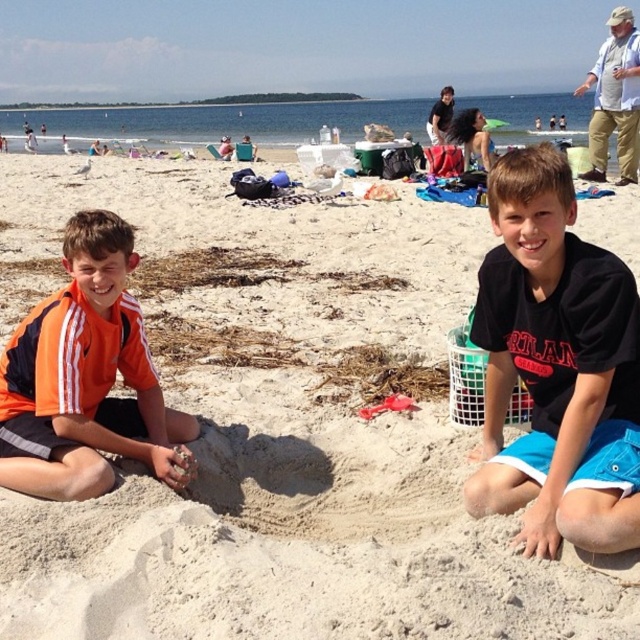
Question: Can you confirm if black cotton shirt at center is smaller than orange jersey at left?

Choices:
 (A) no
 (B) yes

Answer: (A)

Question: Is black cotton shirt at center thinner than orange jersey at left?

Choices:
 (A) no
 (B) yes

Answer: (B)

Question: Considering the relative positions of black cotton shirt at center and orange jersey at left in the image provided, where is black cotton shirt at center located with respect to orange jersey at left?

Choices:
 (A) above
 (B) below

Answer: (A)

Question: Which object is closer to the camera taking this photo?

Choices:
 (A) orange jersey at left
 (B) black cotton shirt at center

Answer: (B)

Question: Among these points, which one is nearest to the camera?

Choices:
 (A) (104, 365)
 (B) (497, 330)

Answer: (B)